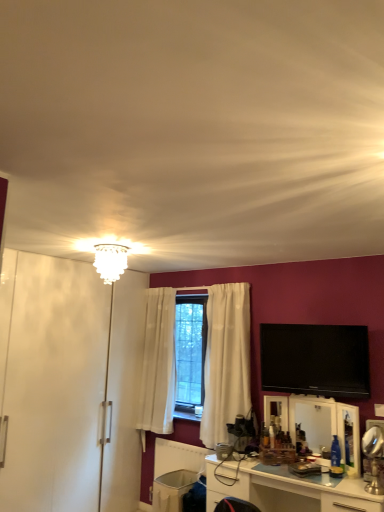
Question: Is white glossy armoire at left wider than white glossy cabinet at lower center?

Choices:
 (A) yes
 (B) no

Answer: (A)

Question: Is the depth of white glossy armoire at left less than that of white glossy cabinet at lower center?

Choices:
 (A) no
 (B) yes

Answer: (A)

Question: Does white glossy armoire at left have a lesser width compared to white glossy cabinet at lower center?

Choices:
 (A) yes
 (B) no

Answer: (B)

Question: Is white glossy armoire at left smaller than white glossy cabinet at lower center?

Choices:
 (A) no
 (B) yes

Answer: (A)

Question: Is white glossy armoire at left placed right next to white glossy cabinet at lower center?

Choices:
 (A) no
 (B) yes

Answer: (A)

Question: Is white glossy cabinet at lower center inside white glossy armoire at left?

Choices:
 (A) no
 (B) yes

Answer: (A)

Question: Is white plastic trash bin at lower center positioned far away from white glossy cabinet at lower center?

Choices:
 (A) yes
 (B) no

Answer: (B)

Question: From a real-world perspective, is white plastic trash bin at lower center on white glossy cabinet at lower center?

Choices:
 (A) yes
 (B) no

Answer: (B)

Question: From the image's perspective, does white plastic trash bin at lower center appear lower than white glossy cabinet at lower center?

Choices:
 (A) yes
 (B) no

Answer: (A)

Question: Can you see white plastic trash bin at lower center touching white glossy cabinet at lower center?

Choices:
 (A) no
 (B) yes

Answer: (A)

Question: Would you say white plastic trash bin at lower center contains white glossy cabinet at lower center?

Choices:
 (A) yes
 (B) no

Answer: (B)

Question: Is white glossy cabinet at lower center at the back of white plastic trash bin at lower center?

Choices:
 (A) no
 (B) yes

Answer: (A)

Question: Is white plastic trash bin at lower center positioned before flat screen tv at upper right?

Choices:
 (A) yes
 (B) no

Answer: (B)